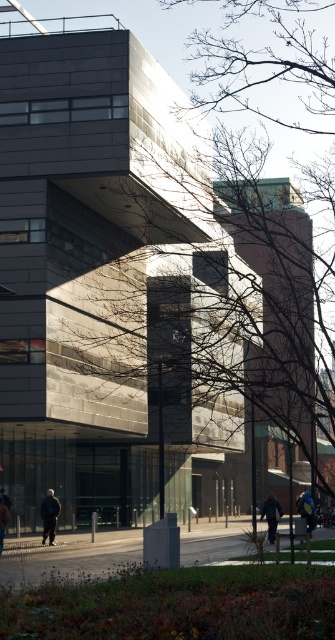
You are a photographer trying to capture both the dark blue jacket at lower center and the dark gray jacket at lower left in the same frame. Which jacket will appear larger in the photo?

The dark blue jacket at lower center will appear larger in the photo because it is bigger than the dark gray jacket at lower left.

You are standing in front of a modern building and see two people wearing jackets. One is wearing a dark blue jacket at lower center and the other a dark gray jacket at lower left. Which jacket is positioned more to the right side of the scene?

The dark blue jacket at lower center is positioned more to the right side of the scene compared to the dark gray jacket at lower left.

You are standing in front of the modern building and see two people wearing jackets. The first person is wearing a dark blue jacket at lower center, and the second person is wearing a dark gray jacket at lower left. Which jacket is closer to the ground?

The dark blue jacket at lower center is closer to the ground because it is positioned under the dark gray jacket at lower left.